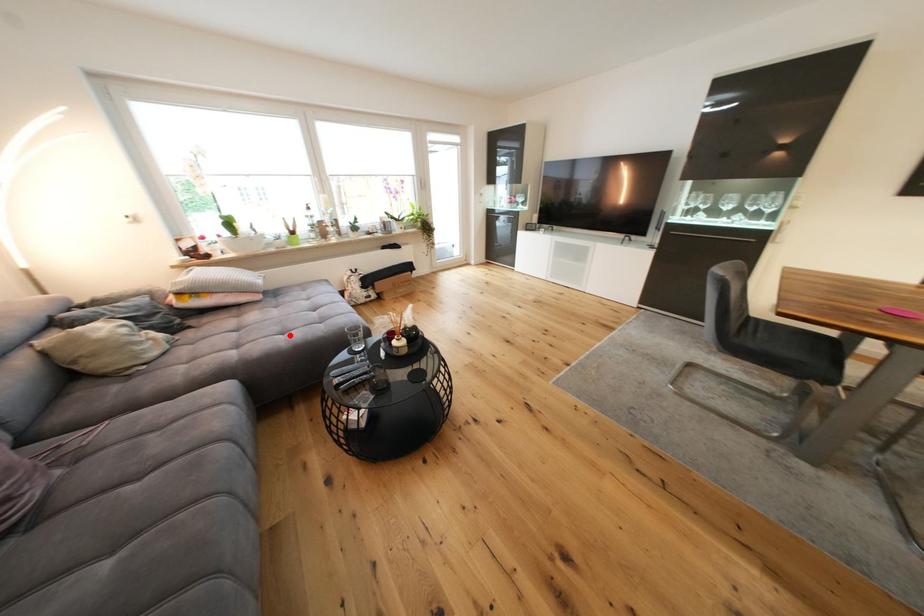
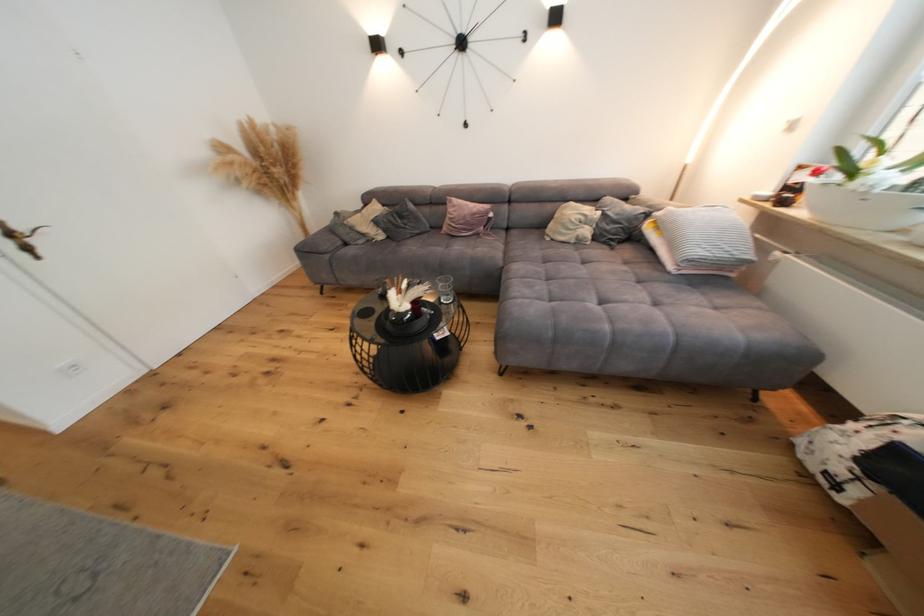
Where in the second image is the point corresponding to the highlighted location from the first image?

(553, 282)